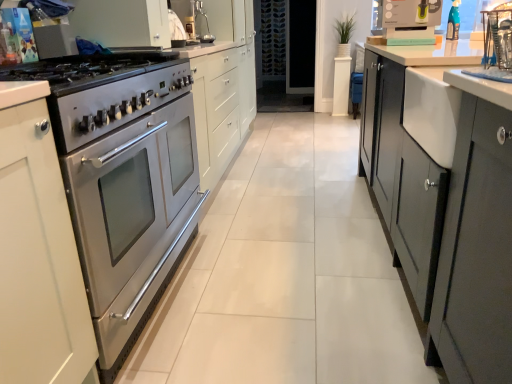
Question: Looking at the image, does stainless steel oven at left seem bigger or smaller compared to transparent glass door at center?

Choices:
 (A) small
 (B) big

Answer: (B)

Question: From the image's perspective, relative to transparent glass door at center, is stainless steel oven at left above or below?

Choices:
 (A) below
 (B) above

Answer: (A)

Question: Estimate the real-world distances between objects in this image. Which object is farther from the matte yellow kettle at upper right?

Choices:
 (A) stainless steel oven at left
 (B) stainless steel oven at left
 (C) matte silver sink at upper center
 (D) satin silver gas stove at left
 (E) transparent glass door at center

Answer: (E)

Question: Which object is positioned closest to the stainless steel oven at left?

Choices:
 (A) satin silver gas stove at left
 (B) stainless steel oven at left
 (C) transparent glass door at center
 (D) matte yellow kettle at upper right
 (E) matte silver sink at upper center

Answer: (B)